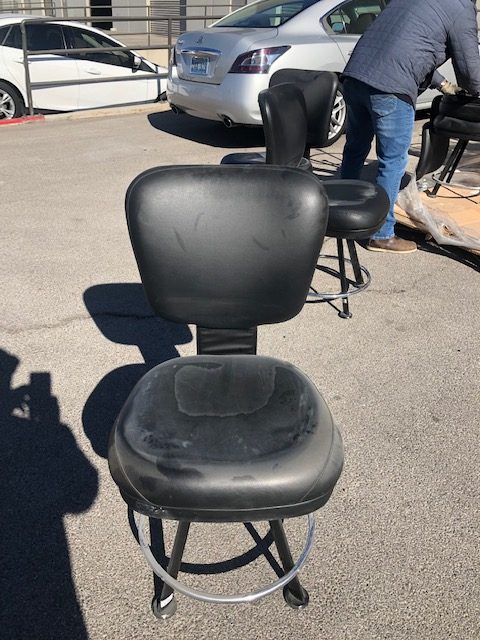
This screenshot has width=480, height=640. In order to click on chair in this screenshot , I will do `click(323, 114)`, `click(340, 205)`, `click(263, 386)`.